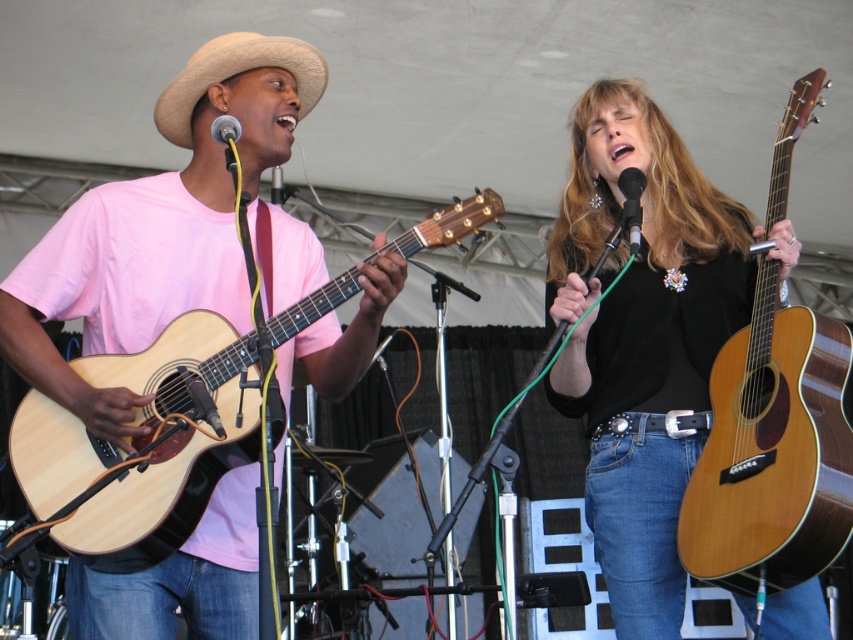
You are a photographer at the live musical performance. You need to capture a closeup shot of the natural wood acoustic guitar at left and the beige straw cowboy hat at upper left. Since you can only focus on one object at a time, which object should you choose to ensure the other object is still in the frame?

The natural wood acoustic guitar at left is taller than the beige straw cowboy hat at upper left. Therefore, if you focus on the taller natural wood acoustic guitar at left, the shorter beige straw cowboy hat at upper left will still be within the frame.

You are a photographer at the back of the stage. You want to take a photo of the beige straw cowboy hat at upper left but the matte black guitar at right is blocking your view. Can you move the guitar to the side so the hat becomes visible?

The matte black guitar at right is in front of the beige straw cowboy hat at upper left, so moving the guitar to the side would allow the hat to become visible.